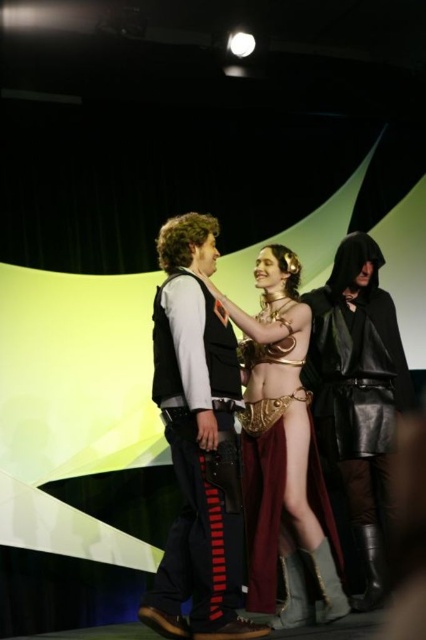
You are standing on the stage and need to hand a prop to the person wearing the velvet black vest at center. Based on their position relative to the other individuals, which direction should you move to reach them?

The velvet black vest at center is located at point [198,442], which is to the right of the left individual and central in the stage. Move towards the center right area to reach them.

You are standing on the stage and want to move from the gold metallic armor at center to the black leather cloak at right. Which direction should you move?

You should move to the right to reach the black leather cloak at right from the gold metallic armor at center because the gold metallic armor at center is to the left of the black leather cloak at right.